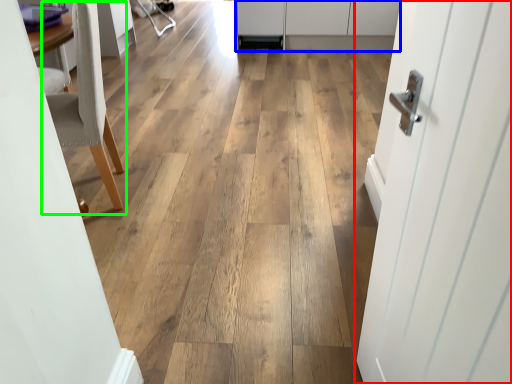
Question: Which is farther away from door (highlighted by a red box)? cabinetry (highlighted by a blue box) or chair (highlighted by a green box)?

Choices:
 (A) cabinetry
 (B) chair

Answer: (A)